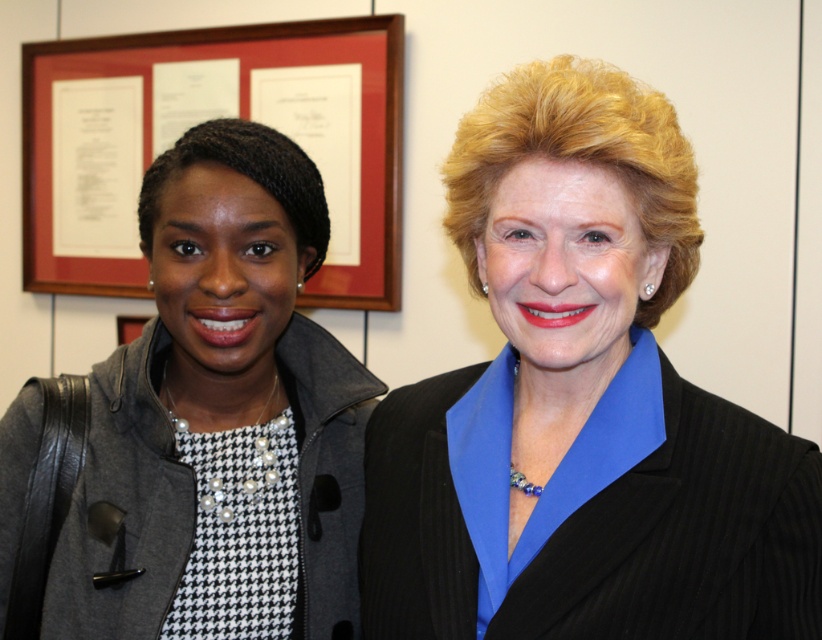
Question: Is matte black blazer at center thinner than wooden frame at upper left?

Choices:
 (A) no
 (B) yes

Answer: (B)

Question: Can you confirm if matte black blazer at center is bigger than wooden frame at upper left?

Choices:
 (A) yes
 (B) no

Answer: (B)

Question: Estimate the real-world distances between objects in this image. Which object is farther from the matte black jacket at left?

Choices:
 (A) wooden frame at upper left
 (B) matte black blazer at center

Answer: (A)

Question: Estimate the real-world distances between objects in this image. Which object is farther from the matte black blazer at center?

Choices:
 (A) wooden frame at upper left
 (B) matte black jacket at left

Answer: (A)

Question: Is matte black blazer at center below matte black jacket at left?

Choices:
 (A) no
 (B) yes

Answer: (A)

Question: Estimate the real-world distances between objects in this image. Which object is farther from the matte black blazer at center?

Choices:
 (A) matte black jacket at left
 (B) wooden frame at upper left

Answer: (B)